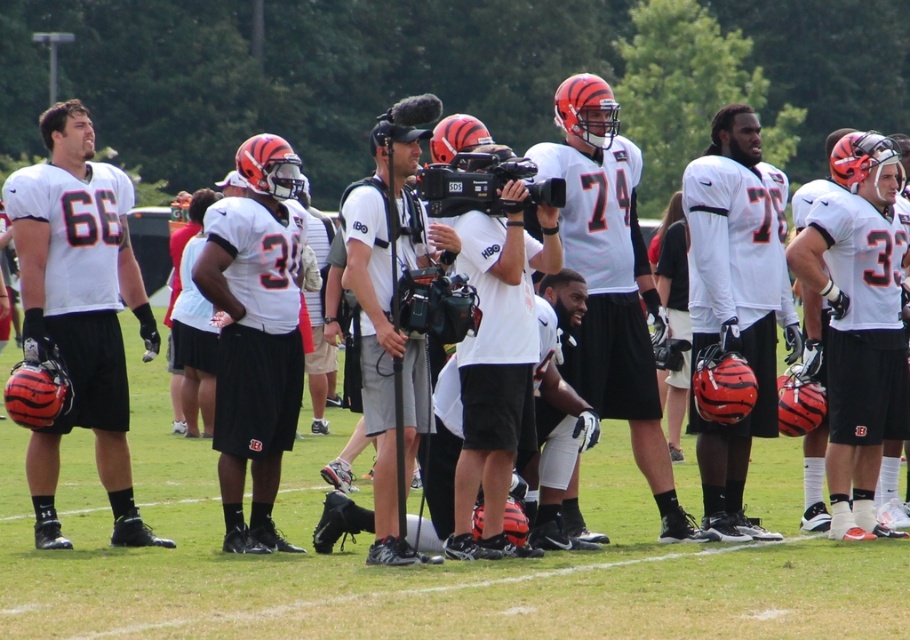
Looking at this image, which is above, matte white jersey at left or white fabric camera at center?

matte white jersey at left

Is matte white jersey at left bigger than white fabric camera at center?

Yes, matte white jersey at left is bigger than white fabric camera at center.

Which is in front, point (52, 426) or point (456, 236)?

Point (456, 236) is in front.

Identify the location of matte white jersey at left. Image resolution: width=910 pixels, height=640 pixels. (79, 310).

Can you confirm if matte white jersey at left is positioned below white matte camera at center?

Incorrect, matte white jersey at left is not positioned below white matte camera at center.

Is matte white jersey at left to the left of white matte camera at center from the viewer's perspective?

Yes, matte white jersey at left is to the left of white matte camera at center.

What do you see at coordinates (79, 310) in the screenshot?
I see `matte white jersey at left` at bounding box center [79, 310].

At what (x,y) coordinates should I click in order to perform the action: click on matte white jersey at left. Please return your answer as a coordinate pair (x, y). Looking at the image, I should click on (79, 310).

Which is behind, point (103, 472) or point (726, 484)?

The point (726, 484) is more distant.

Is matte white jersey at left to the right of white matte helmet at center from the viewer's perspective?

In fact, matte white jersey at left is to the left of white matte helmet at center.

At what (x,y) coordinates should I click in order to perform the action: click on matte white jersey at left. Please return your answer as a coordinate pair (x, y). The image size is (910, 640). Looking at the image, I should click on (79, 310).

Find the location of a particular element. The image size is (910, 640). matte white jersey at left is located at coordinates (79, 310).